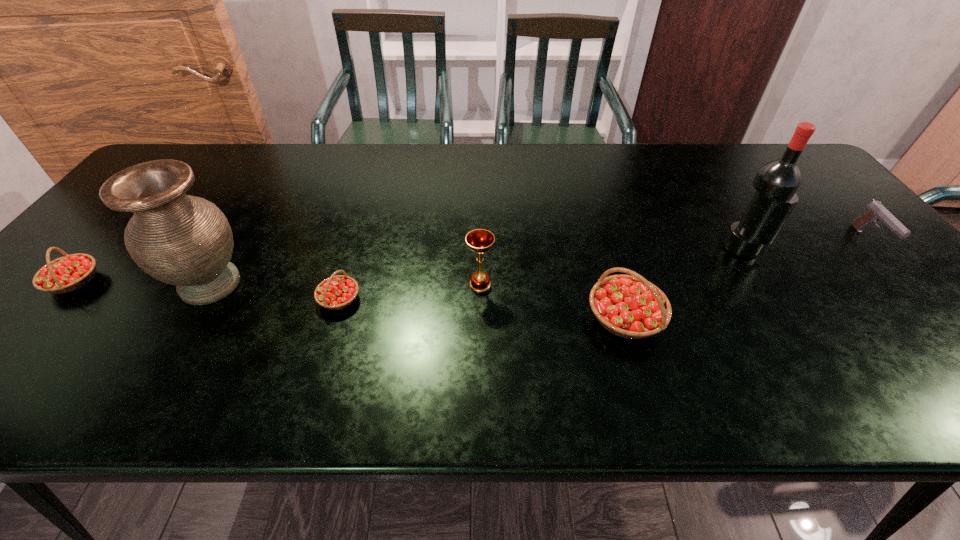
The width and height of the screenshot is (960, 540). What are the coordinates of `free space between the tallest strawberry and the pistol` in the screenshot? It's located at (747, 279).

You are a GUI agent. You are given a task and a screenshot of the screen. Output one action in this format:
    pyautogui.click(x=<x>, y=<y>)
    Task: Click on the free space between the sixth shortest object and the second shortest strawberry
    
    Given the screenshot: What is the action you would take?
    pyautogui.click(x=142, y=283)

Locate an element on the screen. The height and width of the screenshot is (540, 960). object that is the sixth nearest to the vase is located at coordinates (875, 211).

At what (x,y) coordinates should I click in order to perform the action: click on object that is the third nearest to the leftmost object. Please return your answer as a coordinate pair (x, y). The width and height of the screenshot is (960, 540). Looking at the image, I should click on (479, 240).

Identify the location of strawberry identified as the closest to the chalice. (628, 306).

Select which strawberry is the third closest to the vase. Please provide its 2D coordinates. Your answer should be formatted as a tuple, i.e. [(x, y)], where the tuple contains the x and y coordinates of a point satisfying the conditions above.

[(628, 306)]

Where is `free space that satisfies the following two spatial constraints: 1. on the back side of the shortest strawberry; 2. on the right side of the sixth object from left to right`? Image resolution: width=960 pixels, height=540 pixels. free space that satisfies the following two spatial constraints: 1. on the back side of the shortest strawberry; 2. on the right side of the sixth object from left to right is located at coordinates (354, 247).

Locate an element on the screen. The image size is (960, 540). vacant area that satisfies the following two spatial constraints: 1. on the front side of the sixth object from right to left; 2. on the right side of the shortest strawberry is located at coordinates (202, 299).